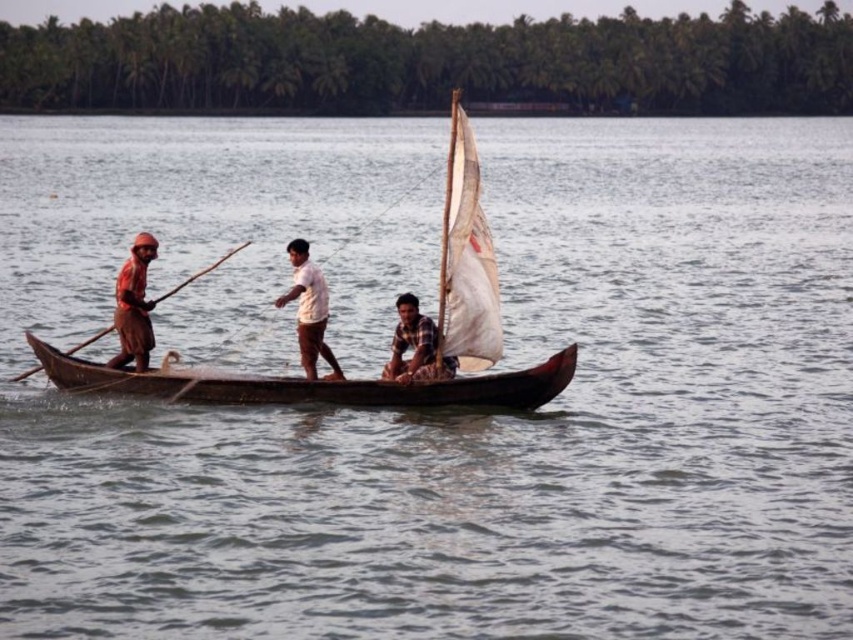
Which is above, matte orange shirt at left or white cotton shirt at center?

Positioned higher is matte orange shirt at left.

Is matte orange shirt at left thinner than white cotton shirt at center?

In fact, matte orange shirt at left might be wider than white cotton shirt at center.

Image resolution: width=853 pixels, height=640 pixels. Identify the location of matte orange shirt at left. (134, 305).

This screenshot has height=640, width=853. Identify the location of matte orange shirt at left. (134, 305).

Is wooden canoe at center to the left of white cotton shirt at center from the viewer's perspective?

No, wooden canoe at center is not to the left of white cotton shirt at center.

Is point (178, 380) closer to viewer compared to point (334, 362)?

Yes, point (178, 380) is closer to viewer.

Between point (482, 401) and point (299, 336), which one is positioned behind?

Positioned behind is point (299, 336).

I want to click on wooden canoe at center, so click(x=396, y=388).

Does matte orange shirt at left have a larger size compared to checkered fabric shirt at center?

Correct, matte orange shirt at left is larger in size than checkered fabric shirt at center.

Is point (123, 339) positioned after point (404, 380)?

Yes, it is behind point (404, 380).

At what (x,y) coordinates should I click in order to perform the action: click on matte orange shirt at left. Please return your answer as a coordinate pair (x, y). Looking at the image, I should click on (134, 305).

Where is `matte orange shirt at left`? This screenshot has width=853, height=640. matte orange shirt at left is located at coordinates (134, 305).